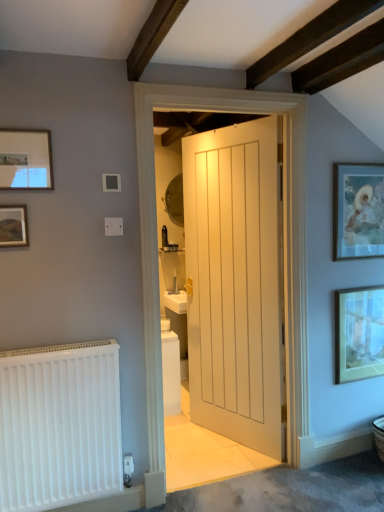
Question: Are white painted wood door at center and white matte radiator at lower left far apart?

Choices:
 (A) yes
 (B) no

Answer: (A)

Question: Considering the relative sizes of white painted wood door at center and white matte radiator at lower left in the image provided, is white painted wood door at center wider than white matte radiator at lower left?

Choices:
 (A) no
 (B) yes

Answer: (A)

Question: Is white painted wood door at center oriented towards white matte radiator at lower left?

Choices:
 (A) no
 (B) yes

Answer: (B)

Question: From a real-world perspective, is white painted wood door at center under white matte radiator at lower left?

Choices:
 (A) yes
 (B) no

Answer: (B)

Question: Can you confirm if white painted wood door at center is bigger than white matte radiator at lower left?

Choices:
 (A) yes
 (B) no

Answer: (A)

Question: Does white painted wood door at center have a lesser height compared to white matte radiator at lower left?

Choices:
 (A) no
 (B) yes

Answer: (A)

Question: Is matte gold picture frame at right, which is the 1th picture frame in right-to-left order, behind matte black picture frame at upper left, the second picture frame positioned from the left?

Choices:
 (A) yes
 (B) no

Answer: (A)

Question: Does matte gold picture frame at right, which appears as the 4th picture frame when viewed from the left, have a lesser height compared to matte black picture frame at upper left, the second picture frame positioned from the left?

Choices:
 (A) no
 (B) yes

Answer: (A)

Question: Is matte black picture frame at upper left, the second picture frame positioned from the left, at the back of matte gold picture frame at right, which is the 1th picture frame in right-to-left order?

Choices:
 (A) no
 (B) yes

Answer: (A)

Question: Is matte gold picture frame at right, which appears as the 4th picture frame when viewed from the left, to the right of matte black picture frame at upper left, the second picture frame positioned from the left, from the viewer's perspective?

Choices:
 (A) yes
 (B) no

Answer: (A)

Question: Is matte black picture frame at upper left, the second picture frame positioned from the left, completely or partially inside matte gold picture frame at right, which appears as the 4th picture frame when viewed from the left?

Choices:
 (A) yes
 (B) no

Answer: (B)

Question: Can you see matte gold picture frame at right, arranged as the 1th picture frame when viewed from the back, touching matte black picture frame at upper left, the second picture frame positioned from the left?

Choices:
 (A) no
 (B) yes

Answer: (A)

Question: Considering the relative sizes of matte black picture frame at upper left, the 3th picture frame from the right, and white matte radiator at lower left in the image provided, is matte black picture frame at upper left, the 3th picture frame from the right, taller than white matte radiator at lower left?

Choices:
 (A) no
 (B) yes

Answer: (A)